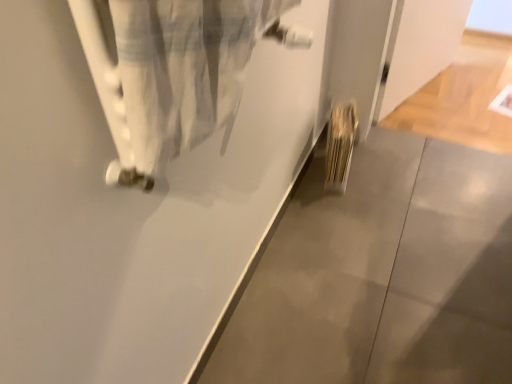
The height and width of the screenshot is (384, 512). What do you see at coordinates (173, 72) in the screenshot? I see `white fabric laundry at lower left` at bounding box center [173, 72].

At what (x,y) coordinates should I click in order to perform the action: click on white fabric laundry at lower left. Please return your answer as a coordinate pair (x, y). Image resolution: width=512 pixels, height=384 pixels. Looking at the image, I should click on (173, 72).

You are a GUI agent. You are given a task and a screenshot of the screen. Output one action in this format:
    pyautogui.click(x=<x>, y=<y>)
    Task: Click on the white fabric laundry at lower left
    Image resolution: width=512 pixels, height=384 pixels.
    Given the screenshot: What is the action you would take?
    pos(173,72)